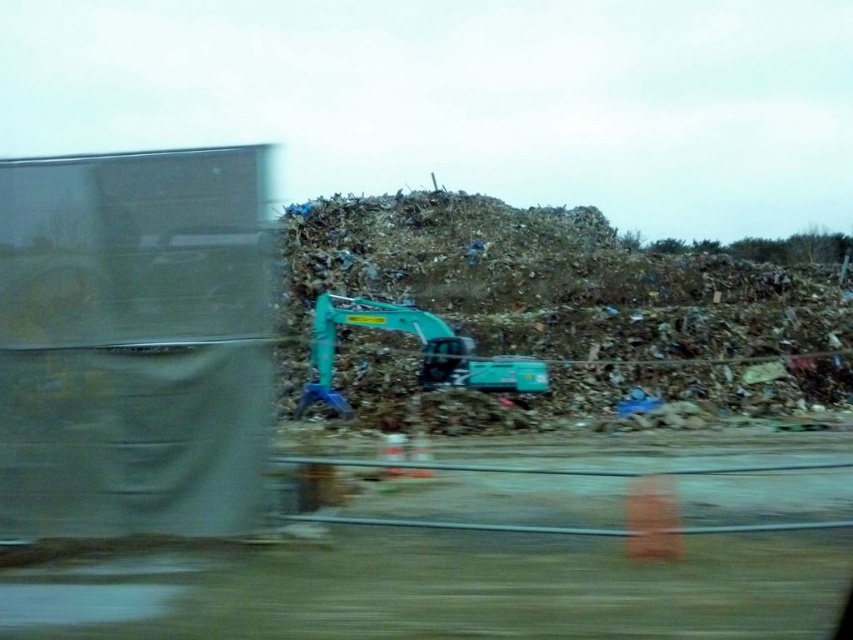
Can you confirm if teal plastic excavator at center is taller than teal rubber excavator at center?

Yes.

Find the location of a particular element. The height and width of the screenshot is (640, 853). teal plastic excavator at center is located at coordinates (573, 300).

Is point (793, 332) in front of point (325, 310)?

No, (793, 332) is further to viewer.

Locate an element on the screen. This screenshot has width=853, height=640. teal plastic excavator at center is located at coordinates (x=573, y=300).

Is matte gray trailer truck at left to the left of teal rubber excavator at center from the viewer's perspective?

No, matte gray trailer truck at left is not to the left of teal rubber excavator at center.

Does matte gray trailer truck at left have a greater width compared to teal rubber excavator at center?

Correct, the width of matte gray trailer truck at left exceeds that of teal rubber excavator at center.

Which is in front, point (67, 342) or point (315, 372)?

Positioned in front is point (67, 342).

Locate an element on the screen. matte gray trailer truck at left is located at coordinates (134, 342).

Based on the photo, is matte gray trailer truck at left smaller than teal plastic excavator at center?

Correct, matte gray trailer truck at left occupies less space than teal plastic excavator at center.

Does matte gray trailer truck at left lie in front of teal plastic excavator at center?

Yes.

Between point (170, 515) and point (393, 394), which one is positioned in front?

Point (170, 515) is more forward.

You are a GUI agent. You are given a task and a screenshot of the screen. Output one action in this format:
    pyautogui.click(x=<x>, y=<y>)
    Task: Click on the matte gray trailer truck at left
    The image size is (853, 640).
    Given the screenshot: What is the action you would take?
    pyautogui.click(x=134, y=342)